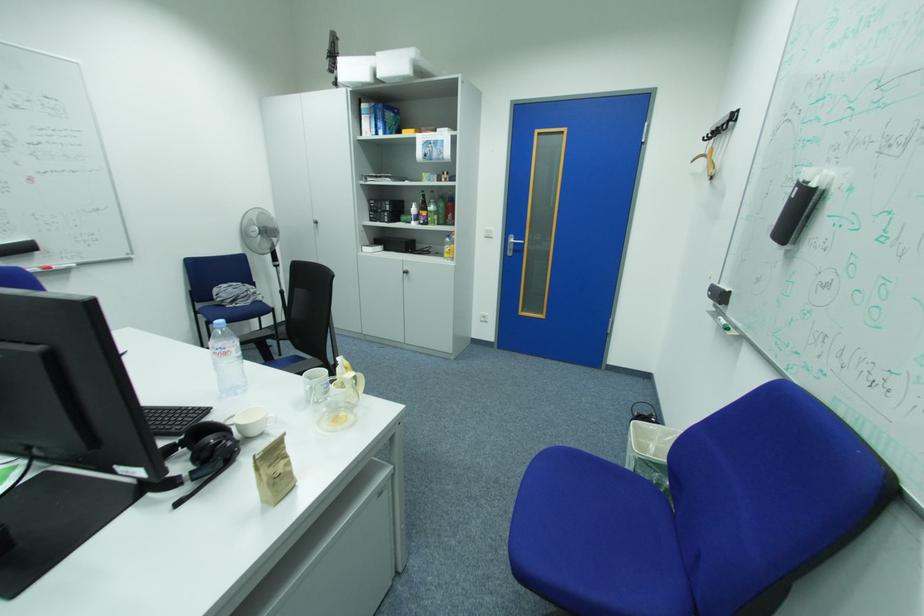
You are a GUI agent. You are given a task and a screenshot of the screen. Output one action in this format:
    pyautogui.click(x=<x>, y=<y>)
    Task: Click on the lower cabinet handle
    The width and height of the screenshot is (924, 616).
    Given the screenshot: What is the action you would take?
    pyautogui.click(x=406, y=276)